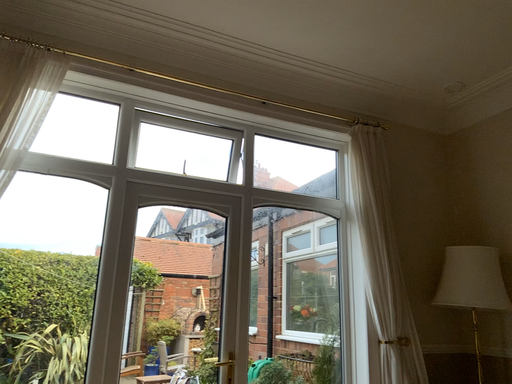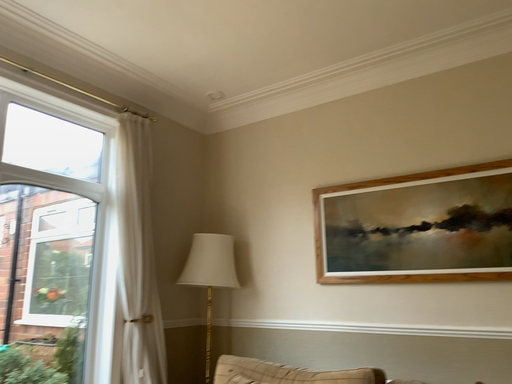
Question: How did the camera likely rotate when shooting the video?

Choices:
 (A) rotated right
 (B) rotated left

Answer: (A)